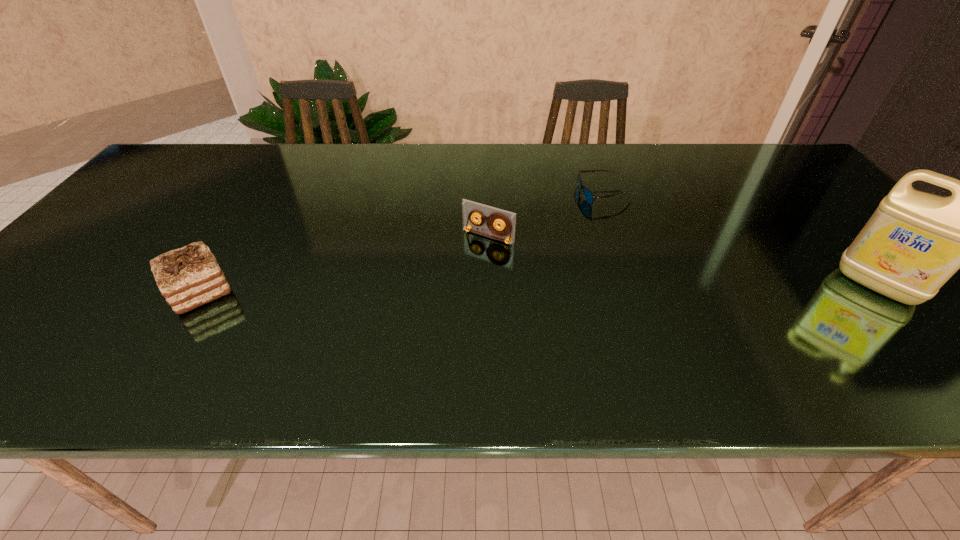
Identify the location of vacant space that is in between the rightmost object and the videotape. (683, 261).

What are the coordinates of `free spot between the leftmost object and the rightmost object` in the screenshot? It's located at (539, 288).

The height and width of the screenshot is (540, 960). I want to click on free spot between the second object from right to left and the detergent, so click(x=741, y=240).

Where is `vacant area that lies between the chocolate cake and the third nearest object`? The image size is (960, 540). vacant area that lies between the chocolate cake and the third nearest object is located at coordinates (344, 264).

Identify the location of the third closest object to the shortest object. Image resolution: width=960 pixels, height=540 pixels. (188, 277).

Where is `object that is the second closest to the farthest object`? The height and width of the screenshot is (540, 960). object that is the second closest to the farthest object is located at coordinates (915, 241).

This screenshot has height=540, width=960. In order to click on vacant area in the image that satisfies the following two spatial constraints: 1. on the back side of the videotape; 2. on the right side of the leftmost object in this screenshot , I will do `click(234, 237)`.

Image resolution: width=960 pixels, height=540 pixels. Identify the location of free region that satisfies the following two spatial constraints: 1. on the back side of the third nearest object; 2. on the right side of the chocolate cake. (234, 237).